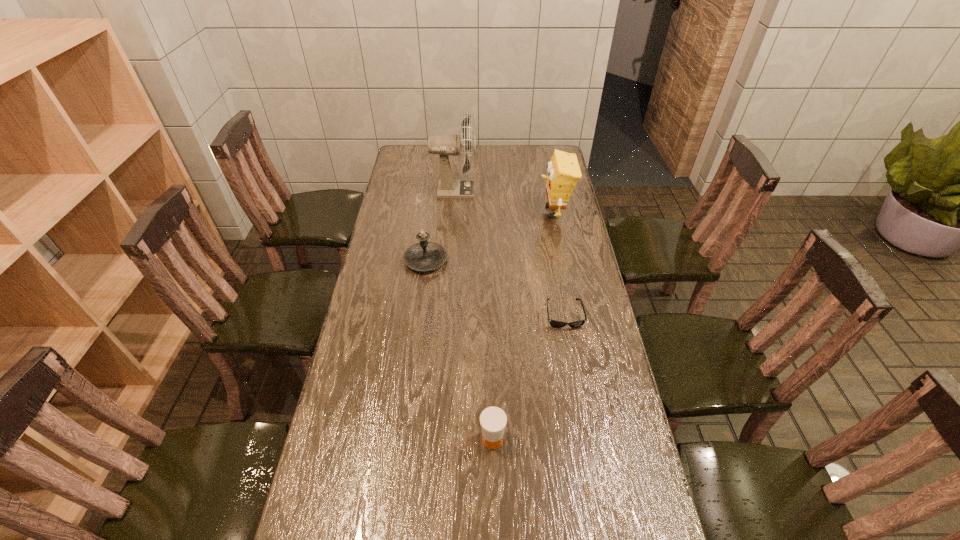
This screenshot has height=540, width=960. I want to click on free spot at the far edge of the desktop, so click(x=456, y=163).

The height and width of the screenshot is (540, 960). I want to click on vacant space at the left edge of the desktop, so click(x=337, y=504).

Locate an element on the screen. Image resolution: width=960 pixels, height=540 pixels. vacant space at the right edge of the desktop is located at coordinates (608, 470).

The image size is (960, 540). In the image, there is a desktop. Find the location of `free space at the far left corner`. free space at the far left corner is located at coordinates click(x=420, y=148).

Identify the location of empty space between the sponge and the fan. The image size is (960, 540). (504, 201).

Identify the location of free spot between the tallest object and the third tallest object. This screenshot has height=540, width=960. (440, 226).

Where is `vacant area between the fan and the fourth tallest object`? The image size is (960, 540). vacant area between the fan and the fourth tallest object is located at coordinates (473, 315).

Locate an element on the screen. The image size is (960, 540). free spot between the medicine and the fan is located at coordinates (473, 315).

Locate an element on the screen. Image resolution: width=960 pixels, height=540 pixels. empty space that is in between the medicine and the sponge is located at coordinates (523, 325).

This screenshot has width=960, height=540. Find the location of `free spot between the fourth tallest object and the third farthest object`. free spot between the fourth tallest object and the third farthest object is located at coordinates (459, 349).